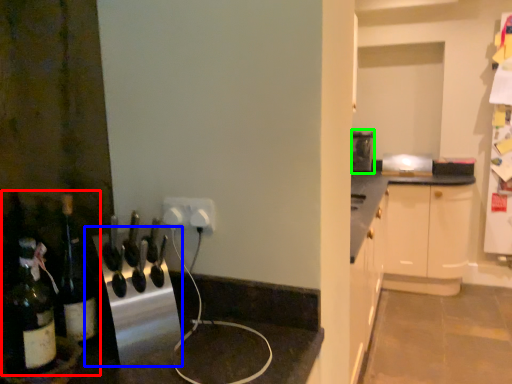
Question: Which object is the closest to the wine tasting (highlighted by a red box)? Choose among these: appliance (highlighted by a blue box) or appliance (highlighted by a green box).

Choices:
 (A) appliance
 (B) appliance

Answer: (A)